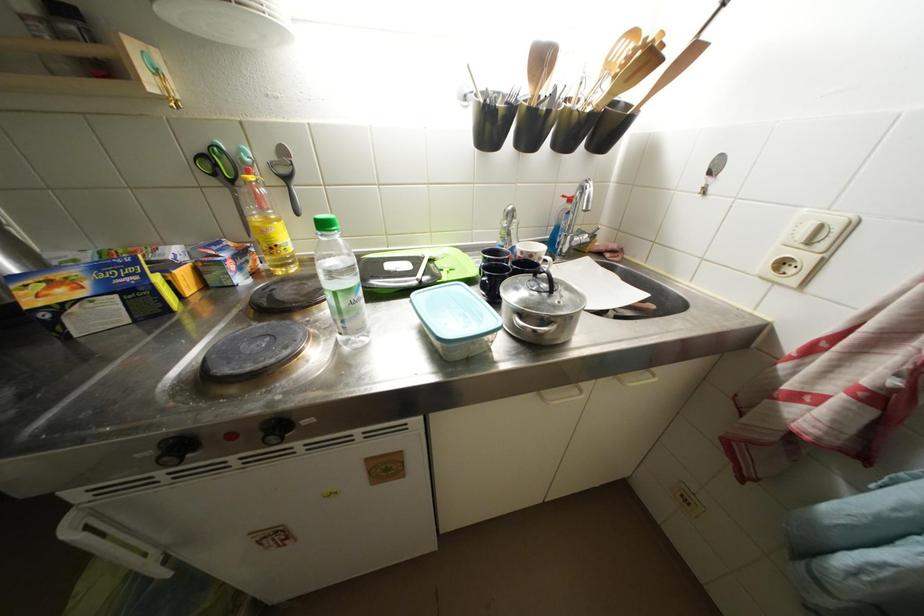
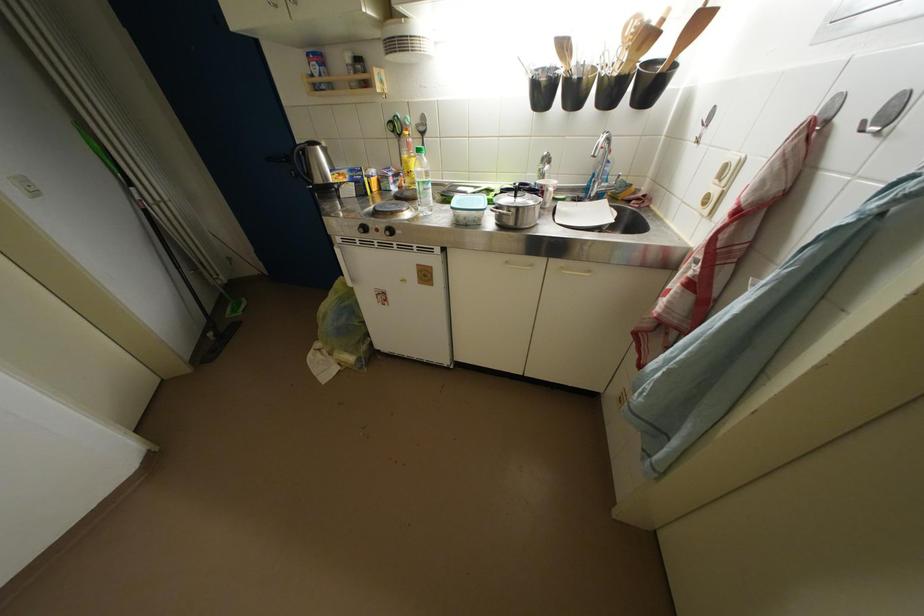
Locate, in the second image, the point that corresponds to point 270,235 in the first image.

(412, 167)